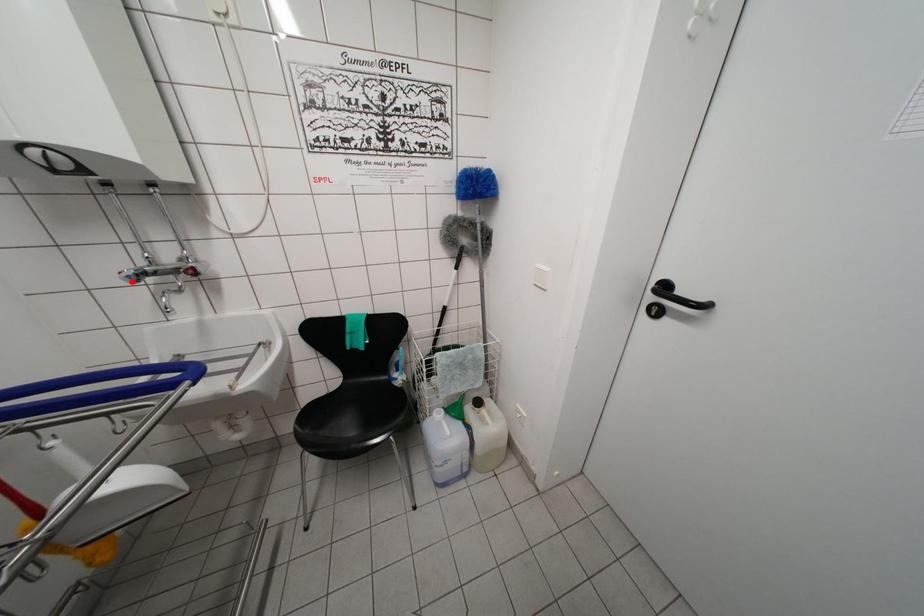
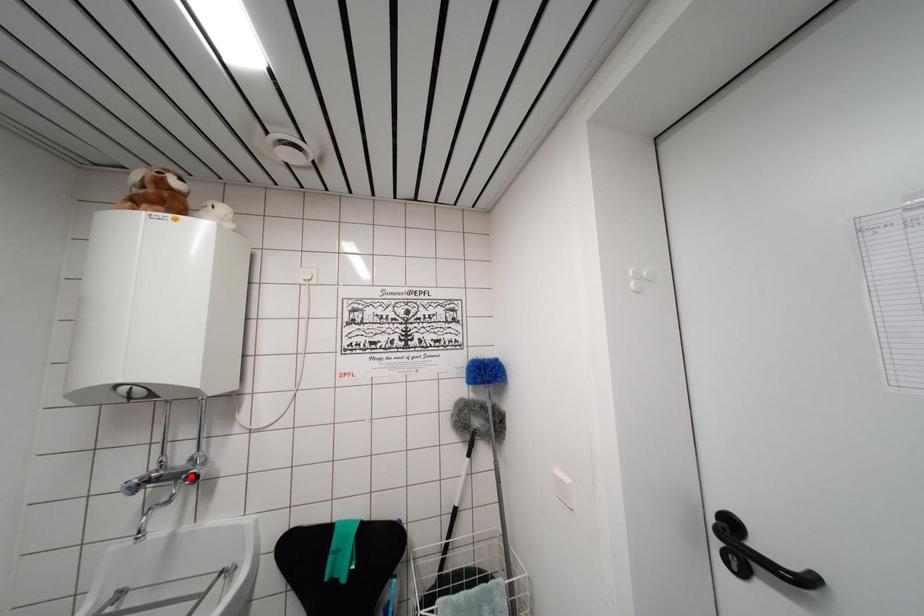
I am providing you with two images of the same scene from different viewpoints. A red point is marked on the first image and another point is marked on the second image. Does the point marked in image1 correspond to the same location as the one in image2?

No